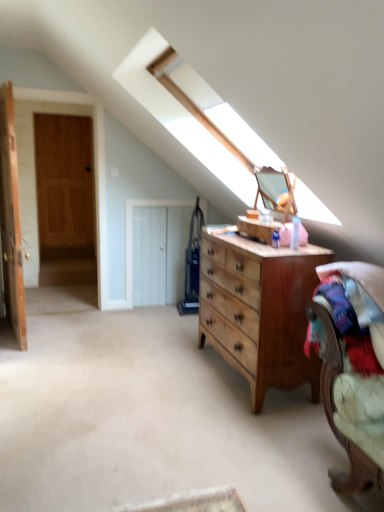
Find the location of a particular element. This screenshot has height=512, width=384. vacant space situated on the left part of wooden dresser at center is located at coordinates (167, 369).